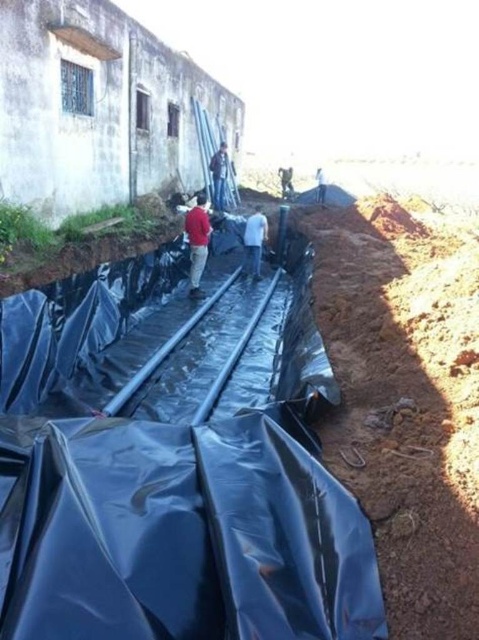
Does red matte shirt at center have a greater height compared to blue jeans at center?

Incorrect, red matte shirt at center's height is not larger of blue jeans at center's.

Between point (191, 253) and point (213, 166), which one is positioned behind?

The point (213, 166) is behind.

Is point (194, 234) less distant than point (221, 152)?

Yes, point (194, 234) is in front of point (221, 152).

What are the coordinates of `red matte shirt at center` in the screenshot? It's located at pyautogui.click(x=196, y=241).

Is blue jeans at center positioned at the back of white fabric bag at center?

No, it is not.

Can you confirm if blue jeans at center is positioned above white fabric bag at center?

No.

Between point (214, 177) and point (316, 173), which one is positioned in front?

Point (214, 177)

Find the location of a particular element. Image resolution: width=479 pixels, height=640 pixels. blue jeans at center is located at coordinates (219, 176).

Between point (253, 259) and point (211, 172), which one is positioned behind?

Positioned behind is point (211, 172).

Who is more forward, (261, 220) or (226, 200)?

Point (261, 220) is in front.

Find the location of a particular element. white matte shirt at center is located at coordinates (253, 243).